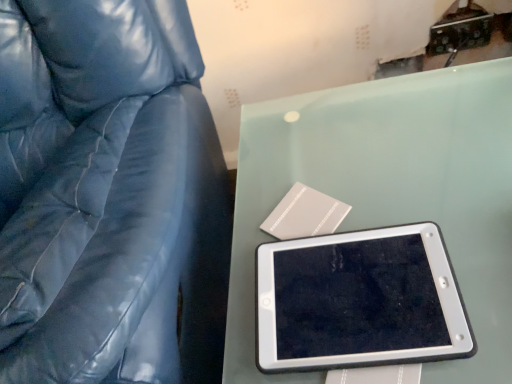
Question: From the image's perspective, is black plastic tablet at center located beneath matte blue leather chair at left?

Choices:
 (A) yes
 (B) no

Answer: (A)

Question: Is black plastic tablet at center touching matte blue leather chair at left?

Choices:
 (A) yes
 (B) no

Answer: (B)

Question: From the image's perspective, is black plastic tablet at center located above matte blue leather chair at left?

Choices:
 (A) no
 (B) yes

Answer: (A)

Question: Is the depth of black plastic tablet at center greater than that of matte blue leather chair at left?

Choices:
 (A) no
 (B) yes

Answer: (B)

Question: Can you confirm if black plastic tablet at center is smaller than matte blue leather chair at left?

Choices:
 (A) yes
 (B) no

Answer: (A)

Question: Is black plastic tablet at center in front of matte blue leather chair at left?

Choices:
 (A) yes
 (B) no

Answer: (B)

Question: Is the depth of matte blue leather chair at left less than that of black plastic tablet at center?

Choices:
 (A) no
 (B) yes

Answer: (B)

Question: From a real-world perspective, is matte blue leather chair at left physically below black plastic tablet at center?

Choices:
 (A) yes
 (B) no

Answer: (A)

Question: Considering the relative sizes of matte blue leather chair at left and black plastic tablet at center in the image provided, is matte blue leather chair at left thinner than black plastic tablet at center?

Choices:
 (A) no
 (B) yes

Answer: (A)

Question: Is matte blue leather chair at left positioned with its back to black plastic tablet at center?

Choices:
 (A) yes
 (B) no

Answer: (B)

Question: Is black plastic tablet at center a part of matte blue leather chair at left?

Choices:
 (A) no
 (B) yes

Answer: (A)

Question: From a real-world perspective, is matte blue leather chair at left located higher than black plastic tablet at center?

Choices:
 (A) no
 (B) yes

Answer: (A)

Question: Is black plastic tablet at center situated inside matte blue leather chair at left or outside?

Choices:
 (A) outside
 (B) inside

Answer: (A)